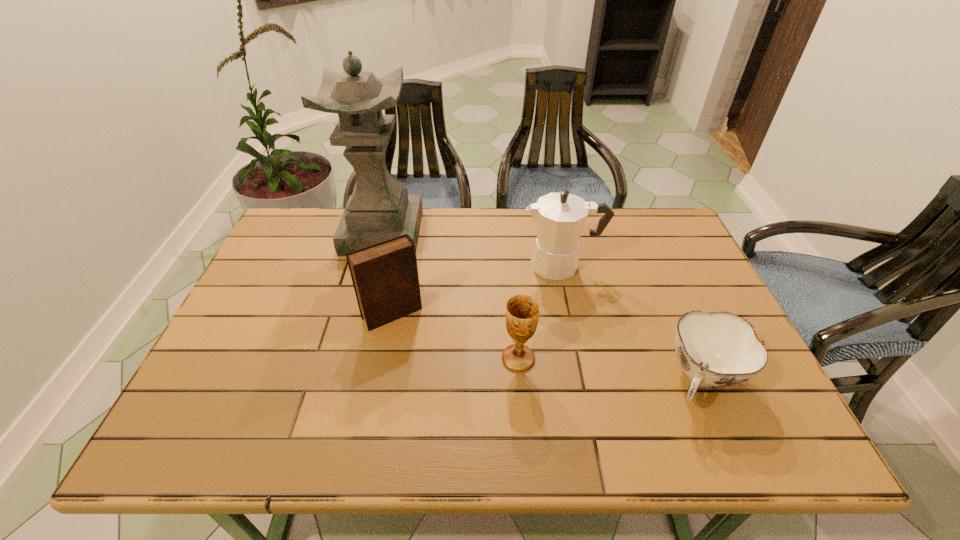
Locate an element on the screen. The height and width of the screenshot is (540, 960). free region located 0.330m on the back of the Bible is located at coordinates click(x=410, y=225).

Where is `blank space located 0.320m on the back of the fourth tallest object`? The image size is (960, 540). blank space located 0.320m on the back of the fourth tallest object is located at coordinates (511, 259).

I want to click on vacant space located 0.230m on the back of the chinaware, so click(x=659, y=280).

The image size is (960, 540). Find the location of `sculpture present at the far edge`. sculpture present at the far edge is located at coordinates (379, 209).

You are a GUI agent. You are given a task and a screenshot of the screen. Output one action in this format:
    pyautogui.click(x=<x>, y=<y>)
    Task: Click on the coffeepot that is at the far edge
    
    Given the screenshot: What is the action you would take?
    pyautogui.click(x=559, y=217)

Locate an element on the screen. The width and height of the screenshot is (960, 540). object located at the near edge is located at coordinates (719, 349).

Identify the location of object located in the right edge section of the desktop. Image resolution: width=960 pixels, height=540 pixels. (719, 349).

Find the location of a particular element. Image resolution: width=960 pixels, height=540 pixels. object situated at the near right corner is located at coordinates (719, 349).

You are a GUI agent. You are given a task and a screenshot of the screen. Output one action in this format:
    pyautogui.click(x=<x>, y=<y>)
    Task: Click on the free space at the far edge
    
    Given the screenshot: What is the action you would take?
    pyautogui.click(x=526, y=240)

This screenshot has width=960, height=540. I want to click on vacant space at the near edge, so 326,416.